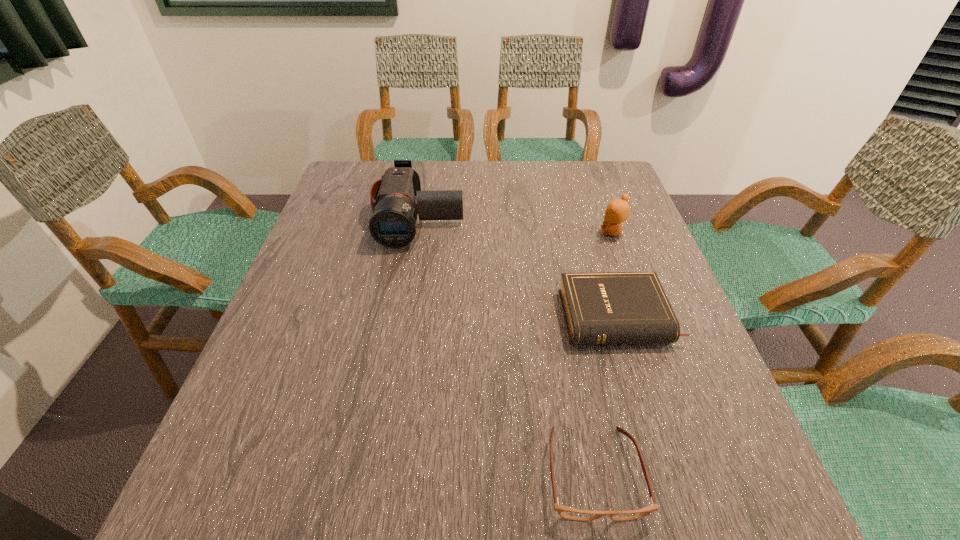
Where is `vacant space at the far right corner of the desktop`? The height and width of the screenshot is (540, 960). vacant space at the far right corner of the desktop is located at coordinates (576, 190).

Where is `vacant area between the Bible and the camcorder`? This screenshot has height=540, width=960. vacant area between the Bible and the camcorder is located at coordinates (518, 267).

I want to click on free point between the spectacles and the Bible, so click(606, 395).

You are a GUI agent. You are given a task and a screenshot of the screen. Output one action in this format:
    pyautogui.click(x=<x>, y=<y>)
    Task: Click on the vacant area between the spectacles and the teddy bear
    This screenshot has height=540, width=960.
    Given the screenshot: What is the action you would take?
    pyautogui.click(x=603, y=353)

The image size is (960, 540). Identify the location of free spot between the leftmost object and the teddy bear. (516, 224).

The image size is (960, 540). I want to click on free space between the Bible and the leftmost object, so click(x=518, y=267).

Image resolution: width=960 pixels, height=540 pixels. I want to click on vacant region between the nearest object and the third farthest object, so click(606, 395).

Locate an element on the screen. free space between the teddy bear and the leftmost object is located at coordinates [516, 224].

In order to click on free space between the camcorder and the teddy bear in this screenshot , I will do click(x=516, y=224).

At what (x,y) coordinates should I click in order to perform the action: click on free area in between the leftmost object and the second nearest object. Please return your answer as a coordinate pair (x, y). Image resolution: width=960 pixels, height=540 pixels. Looking at the image, I should click on (518, 267).